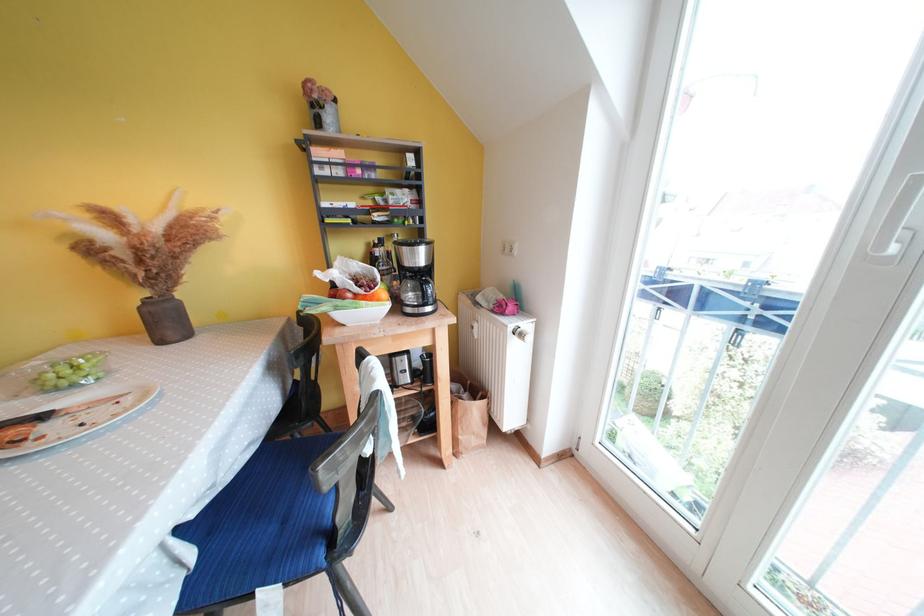
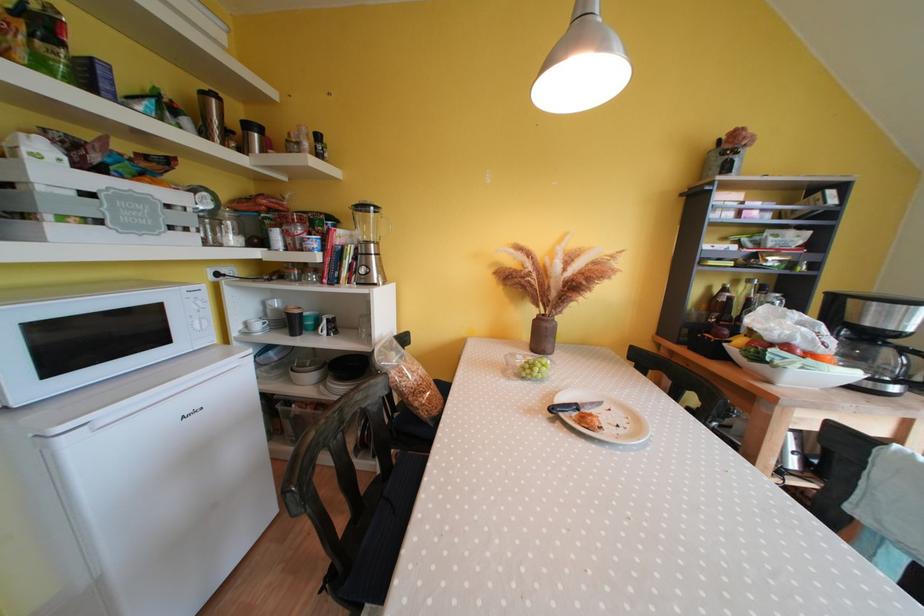
The point at (159, 313) is marked in the first image. Where is the corresponding point in the second image?

(554, 330)